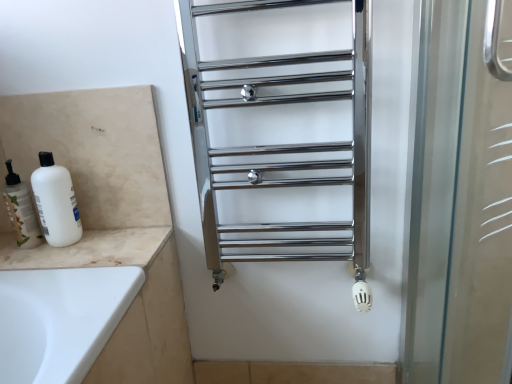
I want to click on vacant area that is in front of white matte bottle at left, so click(51, 257).